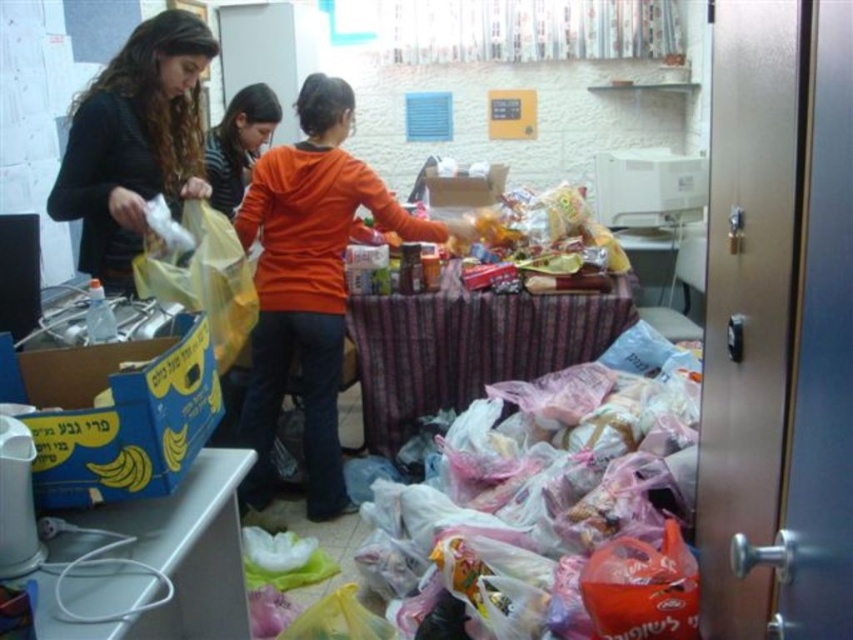
Question: Is matte black sweater at upper left above yellow matte bananas at lower left?

Choices:
 (A) yes
 (B) no

Answer: (A)

Question: Is matte black sweater at upper left positioned behind blue cardboard box at lower left?

Choices:
 (A) no
 (B) yes

Answer: (B)

Question: Can you confirm if orange matte shirt at center is positioned below yellow matte bananas at lower left?

Choices:
 (A) yes
 (B) no

Answer: (B)

Question: Which point is farther to the camera?

Choices:
 (A) yellow cardboard box at lower left
 (B) wooden table at center

Answer: (B)

Question: Which object appears farthest from the camera in this image?

Choices:
 (A) orange matte sweater at center
 (B) orange matte shirt at center

Answer: (B)

Question: Which is nearer to the orange matte sweater at center?

Choices:
 (A) matte black sweater at upper left
 (B) blue cardboard box at lower left

Answer: (A)